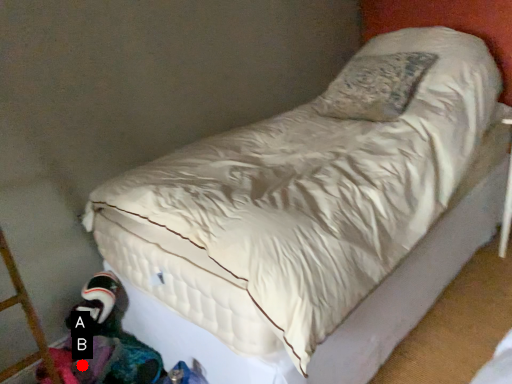
Question: Two points are circled on the image, labeled by A and B beside each circle. Which point is closer to the camera?

Choices:
 (A) A is closer
 (B) B is closer

Answer: (B)